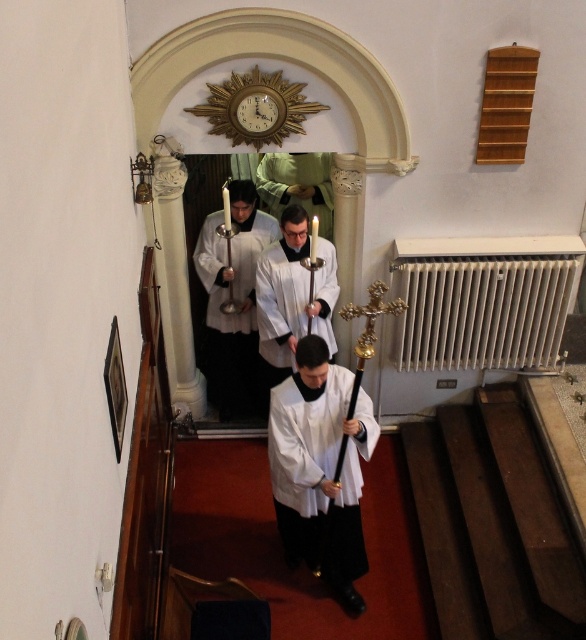
You are a member of the clergy in the scene and need to light your candle. The candle is on a stand that requires a heat source. There is a white metallic radiator at right and a white glossy robe at center. Which object is closer to your current position at the center?

The white glossy robe at center is closer to your current position at the center since it is located at the center, while the white metallic radiator at right is further away.

You are standing at the entrance of the church and want to find the white metallic radiator at right. According to the scene description, where should you look relative to the arched doorway with the clock?

The white metallic radiator at right is located at point 0.470 on the x axis and 0.826 on the y axis relative to the arched doorway with the clock.